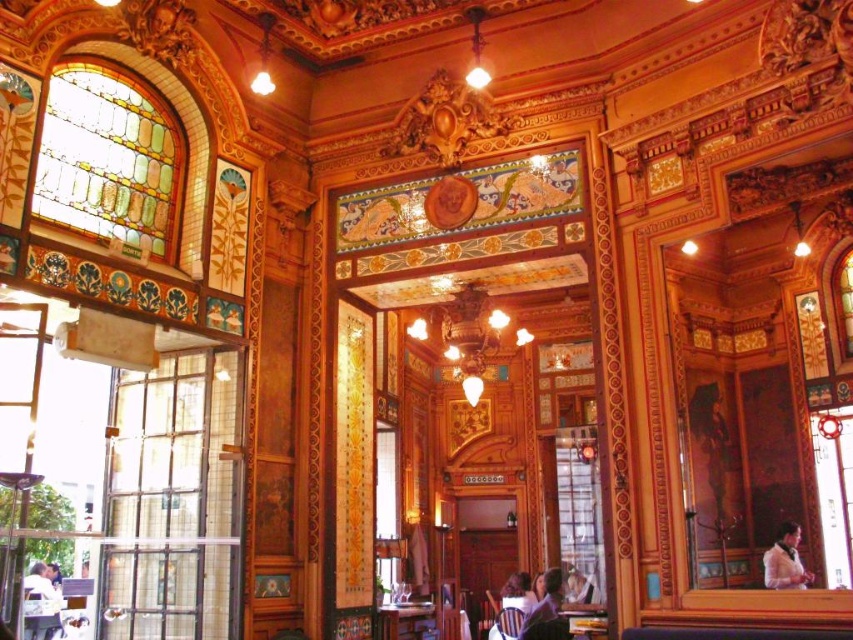
Does light brown leather jacket at lower right appear over wooden table at center?

Yes, light brown leather jacket at lower right is above wooden table at center.

Can you confirm if light brown leather jacket at lower right is positioned to the left of wooden table at center?

No, light brown leather jacket at lower right is not to the left of wooden table at center.

Does point (790, 544) lie behind point (425, 611)?

No, (790, 544) is closer to viewer.

Image resolution: width=853 pixels, height=640 pixels. What are the coordinates of `light brown leather jacket at lower right` in the screenshot? It's located at (785, 561).

Between light brown leather jacket at lower right and smooth brown hair at center, which one has less height?

With less height is light brown leather jacket at lower right.

Can you confirm if light brown leather jacket at lower right is smaller than smooth brown hair at center?

Correct, light brown leather jacket at lower right occupies less space than smooth brown hair at center.

Which is in front, point (782, 570) or point (543, 620)?

Point (543, 620) is in front.

Identify the location of light brown leather jacket at lower right. The height and width of the screenshot is (640, 853). (785, 561).

What do you see at coordinates (407, 620) in the screenshot?
I see `wooden table at center` at bounding box center [407, 620].

Does wooden table at center have a greater width compared to smooth brown hair at center?

In fact, wooden table at center might be narrower than smooth brown hair at center.

Identify the location of wooden table at center. This screenshot has width=853, height=640. [407, 620].